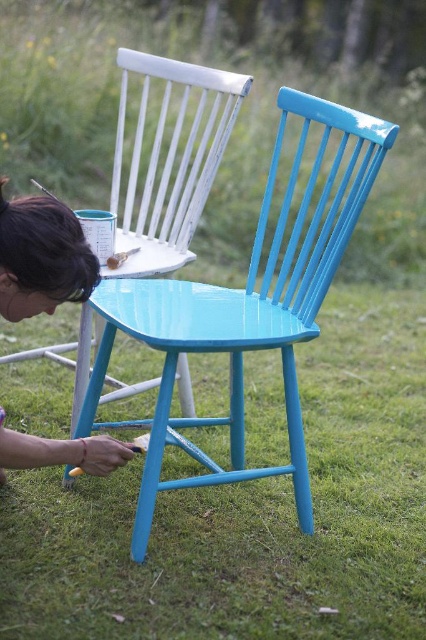
You are standing in the grassy area and want to place a new potted plant exactly where the matte blue chair at center is located. What are the coordinates where you should place the potted plant?

The coordinates for the matte blue chair at center are at point (169,163), so you should place the potted plant at those coordinates.

You are helping someone paint a chair in the garden. You see a glossy wood chair at center and a matte blue chair at center. Which chair is shorter in height?

The glossy wood chair at center is shorter than the matte blue chair at center.